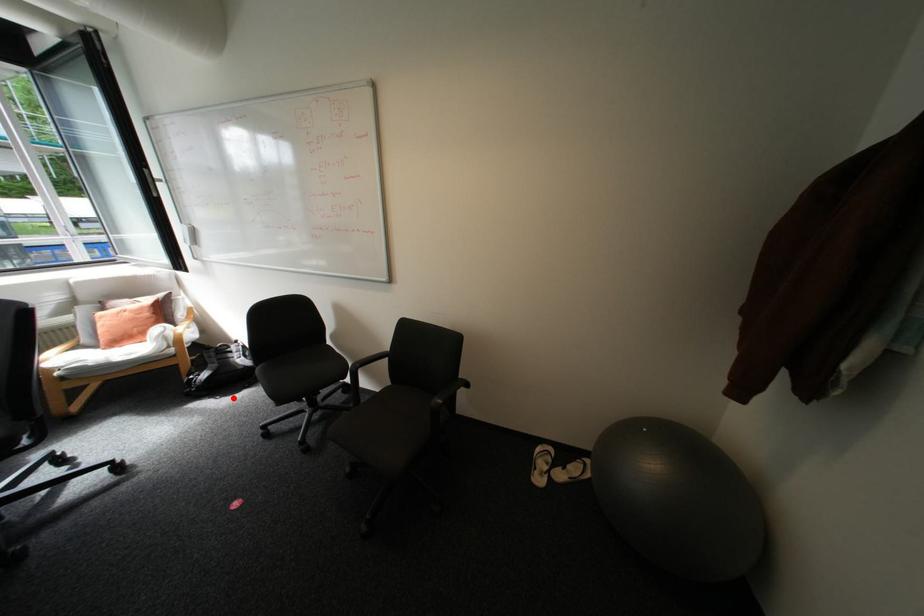
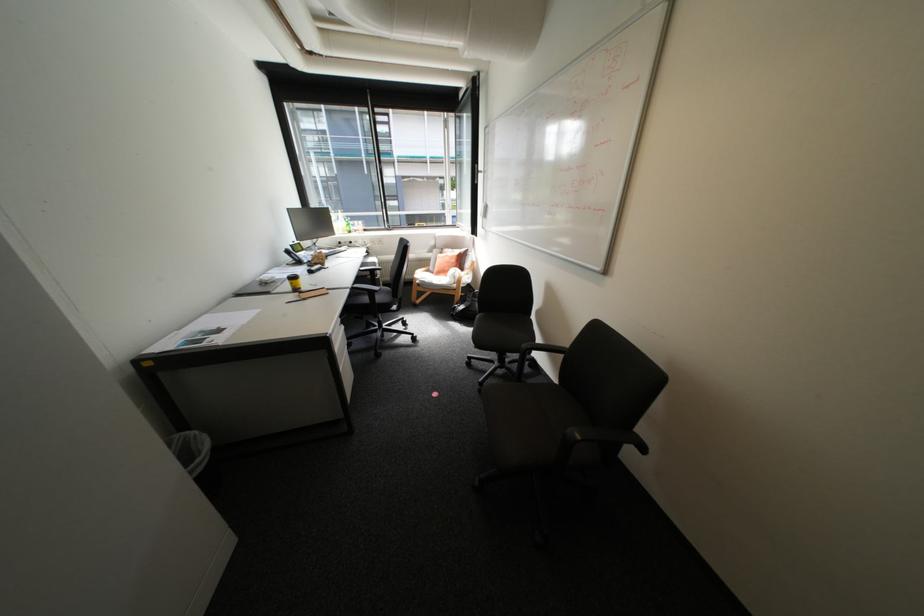
Question: I am providing you with two images of the same scene from different viewpoints. Image1 has a red point marked. In image2, the corresponding 3D location appears at what relative position? Reply with the corresponding letter.

Choices:
 (A) Closer
 (B) Farther

Answer: (B)